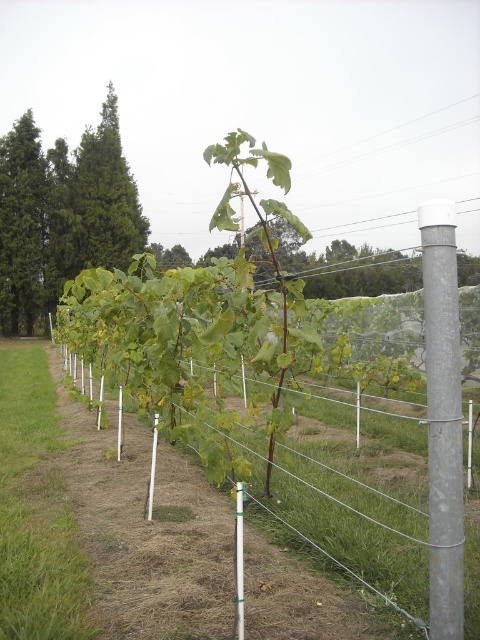
Which is more to the left, green textured tree at upper left or green matte tree at upper left?

From the viewer's perspective, green matte tree at upper left appears more on the left side.

Is green textured tree at upper left to the left of green matte tree at upper left from the viewer's perspective?

No, green textured tree at upper left is not to the left of green matte tree at upper left.

The height and width of the screenshot is (640, 480). In order to click on green textured tree at upper left in this screenshot , I will do `click(61, 214)`.

Who is positioned more to the right, green matte tree at upper left or silver metallic pole at center?

silver metallic pole at center

Where is `green matte tree at upper left`? This screenshot has height=640, width=480. green matte tree at upper left is located at coordinates click(22, 227).

Which is above, wire mesh fence at center or green textured tree at upper left?

Positioned higher is green textured tree at upper left.

How distant is wire mesh fence at center from green textured tree at upper left?

114.37 feet

Is point (335, 445) closer to camera compared to point (58, 275)?

Yes, point (335, 445) is in front of point (58, 275).

Locate an element on the screen. wire mesh fence at center is located at coordinates (360, 500).